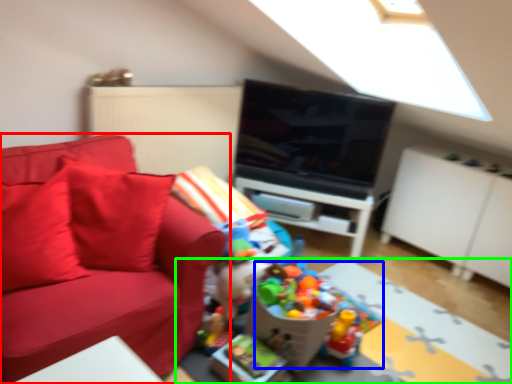
Question: Which object is the farthest from studio couch (highlighted by a red box)? Choose among these: toy (highlighted by a blue box) or table (highlighted by a green box).

Choices:
 (A) toy
 (B) table

Answer: (B)